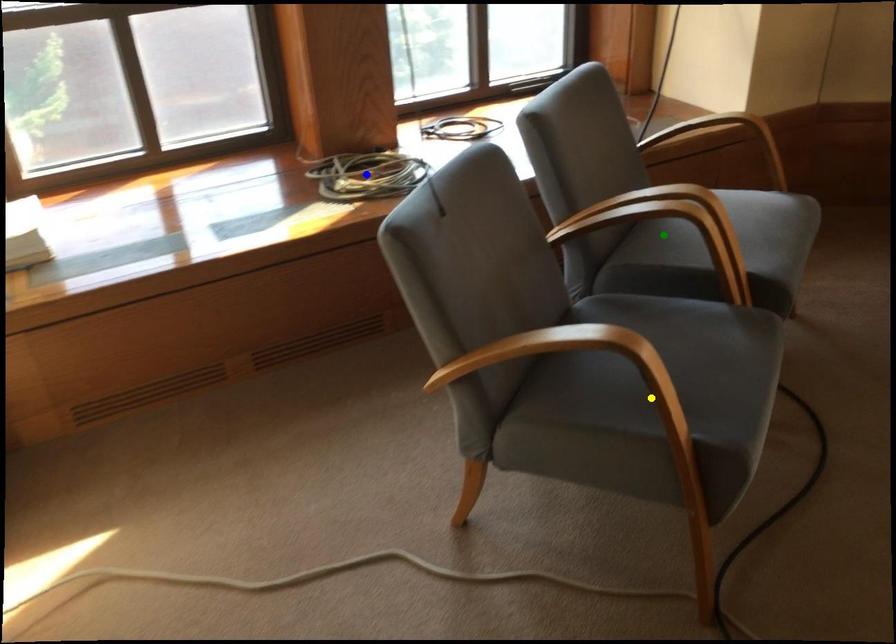
Looking at this image, order these from nearest to farthest:
yellow point | green point | blue point

yellow point
green point
blue point